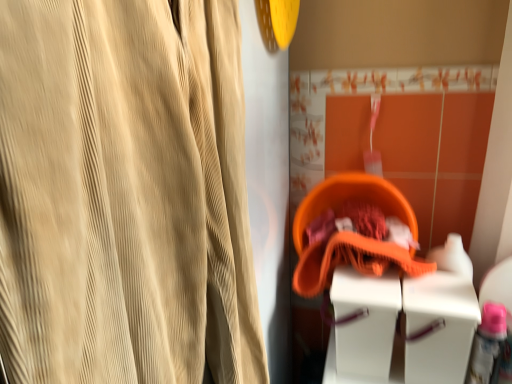
Question: Based on their sizes in the image, would you say beige corduroy curtain at left is bigger or smaller than white plastic vanity at lower right?

Choices:
 (A) small
 (B) big

Answer: (B)

Question: From a real-world perspective, is beige corduroy curtain at left physically located above or below white plastic vanity at lower right?

Choices:
 (A) below
 (B) above

Answer: (B)

Question: Which object is positioned farthest from the beige corduroy curtain at left?

Choices:
 (A) orange fabric basket at center
 (B) white plastic vanity at lower right

Answer: (A)

Question: Which object is positioned farthest from the beige corduroy curtain at left?

Choices:
 (A) white plastic vanity at lower right
 (B) orange fabric basket at center

Answer: (B)